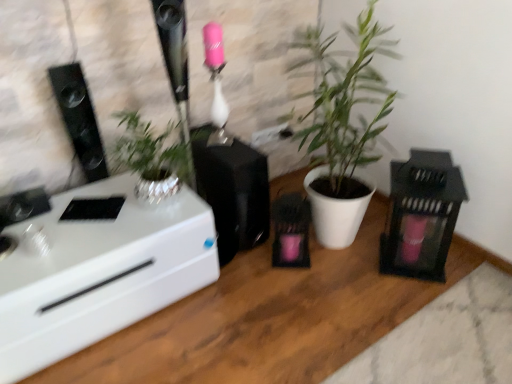
Locate an element on the screen. The image size is (512, 384). vacant space positioned to the left of black matte lantern at right, which is the 2th appliance from left to right is located at coordinates (349, 264).